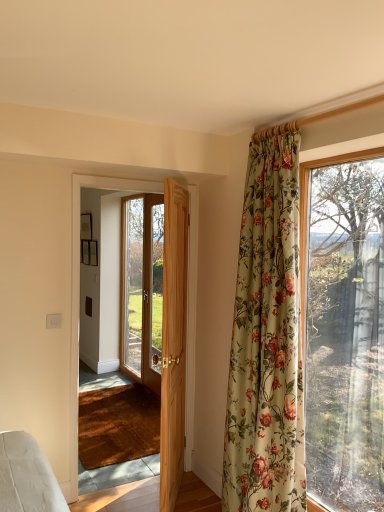
Question: Is point (160, 432) positioned closer to the camera than point (92, 177)?

Choices:
 (A) closer
 (B) farther

Answer: (A)

Question: Would you say light brown wooden door at center, the 3th door in the back-to-front sequence, is to the left or to the right of wooden door at center, which ranks as the second door in back-to-front order, in the picture?

Choices:
 (A) right
 (B) left

Answer: (A)

Question: Which of these objects is positioned closest to the floral fabric curtain at right?

Choices:
 (A) wooden door at center, the second door when ordered from front to back
 (B) light brown wooden door at center, the 1th door viewed from the front
 (C) wooden door at center, which is counted as the third door, starting from the front

Answer: (B)

Question: Estimate the real-world distances between objects in this image. Which object is farther from the light brown wooden door at center, the 3th door in the back-to-front sequence?

Choices:
 (A) wooden door at center, which is counted as the third door, starting from the front
 (B) wooden door at center, the second door when ordered from front to back
 (C) floral fabric curtain at right

Answer: (A)